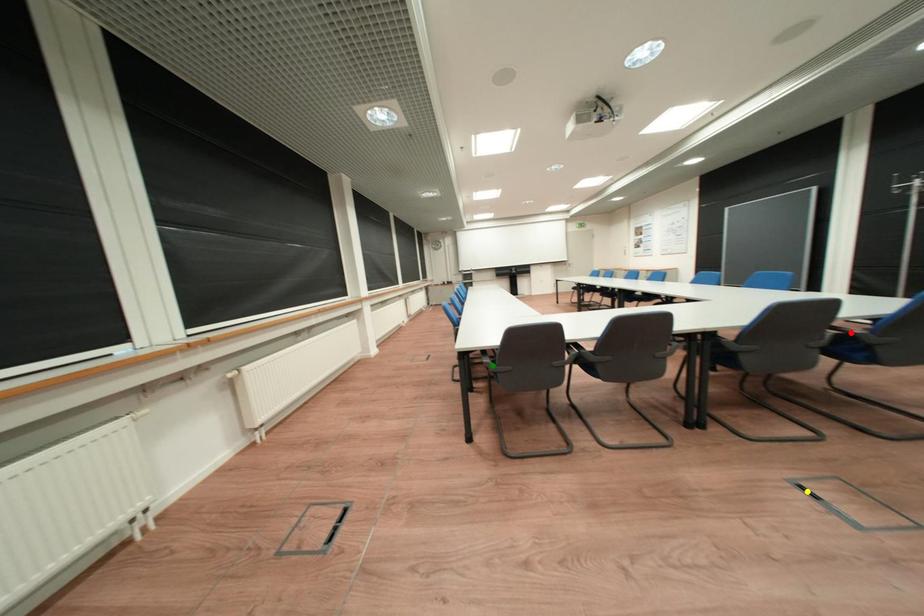
Order these from nearest to farthest:
- yellow point
- red point
- green point

green point < red point < yellow point